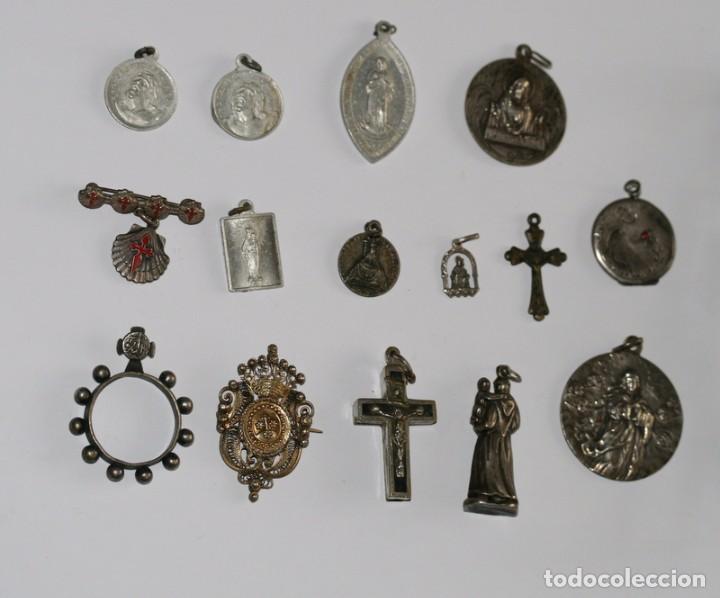
Where is `trinkets in top row`? The width and height of the screenshot is (720, 598). trinkets in top row is located at coordinates (156, 99), (518, 114), (378, 100), (247, 120).